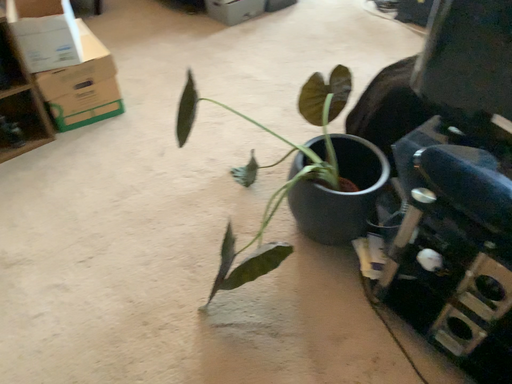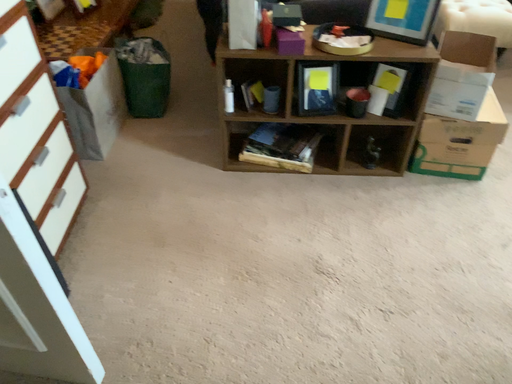
Question: Which way did the camera rotate in the video?

Choices:
 (A) rotated right
 (B) rotated left

Answer: (B)